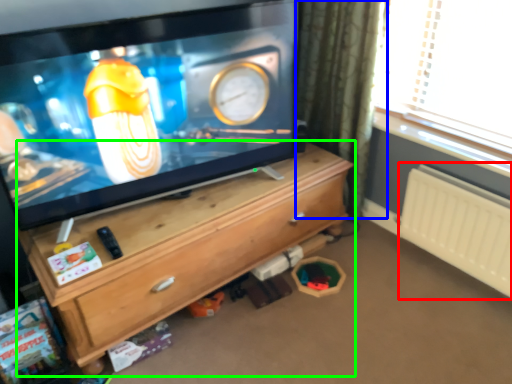
Question: Which object is the closest to the radiator (highlighted by a red box)? Choose among these: curtain (highlighted by a blue box) or chest of drawers (highlighted by a green box).

Choices:
 (A) curtain
 (B) chest of drawers

Answer: (A)